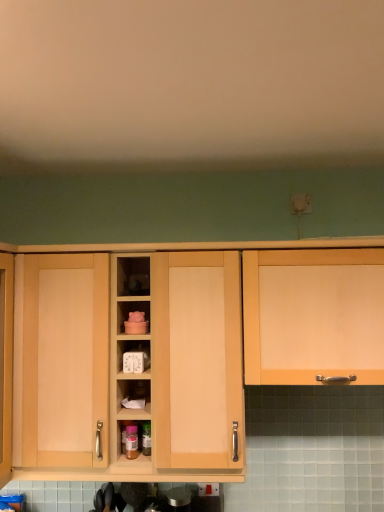
Question: Considering their positions, is light wood cabinet at center, which is the first cabinetry from left to right, located in front of or behind matte wood cabinet at right, positioned as the first cabinetry in right-to-left order?

Choices:
 (A) front
 (B) behind

Answer: (B)

Question: From a real-world perspective, is light wood cabinet at center, which is the first cabinetry from left to right, above or below matte wood cabinet at right, positioned as the first cabinetry in right-to-left order?

Choices:
 (A) below
 (B) above

Answer: (A)

Question: Which is farther from the light wood cabinet at center, which is the first cabinetry from left to right?

Choices:
 (A) matte wood cabinet at right, positioned as the first cabinetry in right-to-left order
 (B) white plastic timer at center

Answer: (B)

Question: Based on their relative distances, which object is nearer to the light wood cabinet at center, which is counted as the second cabinetry, starting from the right?

Choices:
 (A) matte wood cabinet at right, placed as the 2th cabinetry when sorted from left to right
 (B) white plastic timer at center

Answer: (A)